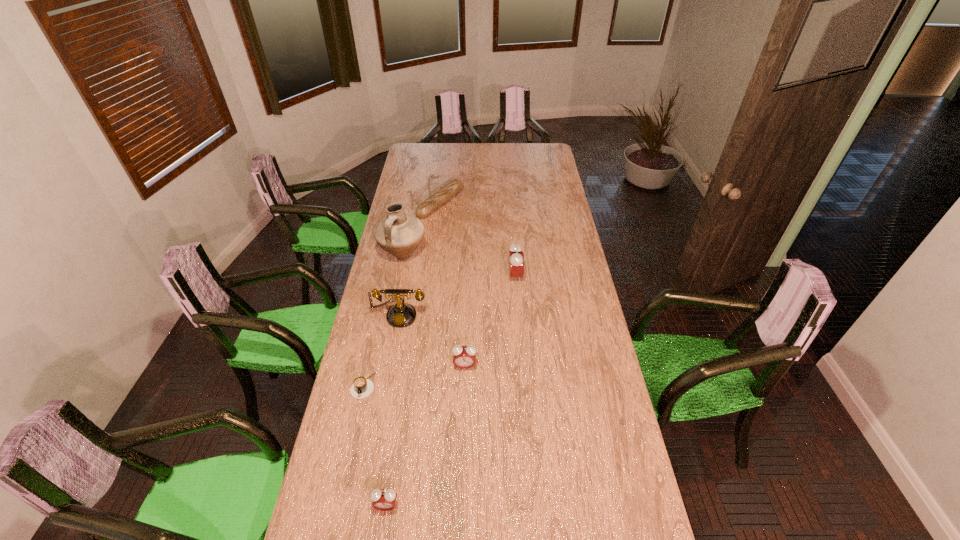
Where is `the shortest alarm clock`? The width and height of the screenshot is (960, 540). the shortest alarm clock is located at coordinates (383, 499).

Where is `the nearest alarm clock`? the nearest alarm clock is located at coordinates (383, 499).

Locate an element on the screen. the second farthest alarm clock is located at coordinates (464, 357).

In order to click on the fifth farthest object in this screenshot , I will do `click(464, 357)`.

Image resolution: width=960 pixels, height=540 pixels. Find the location of `the rightmost alarm clock`. the rightmost alarm clock is located at coordinates (516, 256).

This screenshot has width=960, height=540. Find the location of `the rightmost object`. the rightmost object is located at coordinates click(516, 256).

Identify the location of the tallest object. click(399, 234).

Find the location of a particular element. The width and height of the screenshot is (960, 540). the fourth nearest object is located at coordinates tap(400, 315).

Find the location of a particular element. Image resolution: width=960 pixels, height=540 pixels. cappuccino is located at coordinates (362, 387).

The image size is (960, 540). Identify the location of the sixth farthest object. (362, 387).